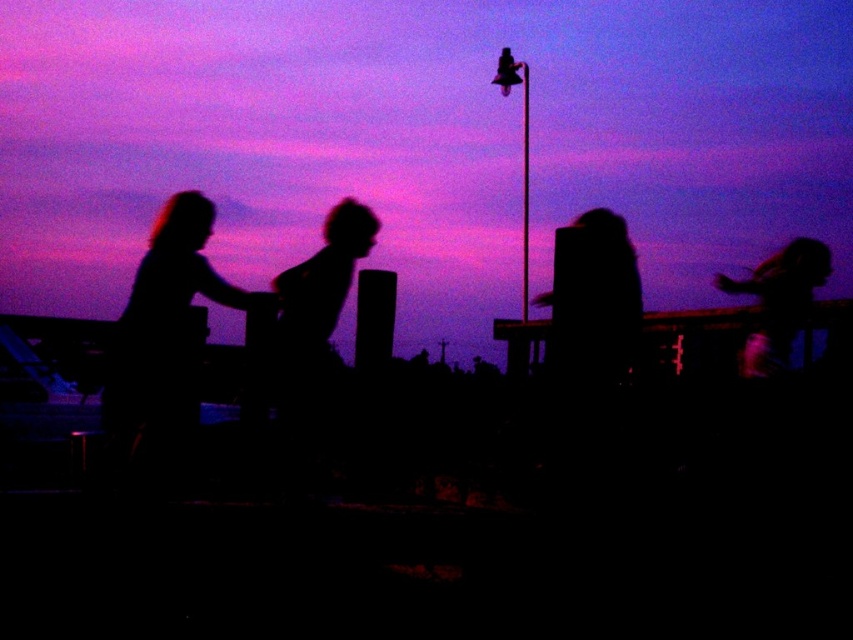
Question: Is silhouette hair at left wider than silhouette hair at upper right?

Choices:
 (A) no
 (B) yes

Answer: (B)

Question: Where is silhouette hair at left located in relation to silhouette hair at upper right in the image?

Choices:
 (A) left
 (B) right

Answer: (A)

Question: Is silhouette hair at left bigger than silhouette hair at upper right?

Choices:
 (A) no
 (B) yes

Answer: (B)

Question: Which of the following is the farthest from the observer?

Choices:
 (A) silhouette hair at upper right
 (B) silhouette hair at left

Answer: (A)